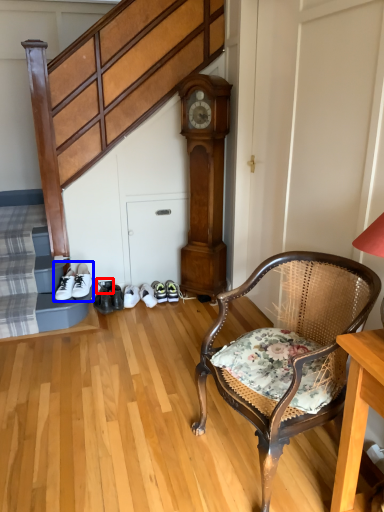
Question: Which of the following is the closest to the observer, shoe (highlighted by a red box) or footwear (highlighted by a blue box)?

Choices:
 (A) shoe
 (B) footwear

Answer: (B)